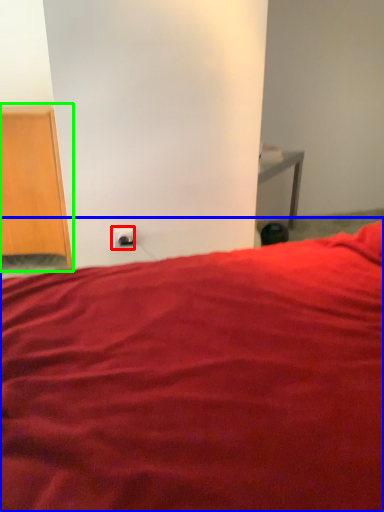
Question: Which is farther away from electric outlet (highlighted by a red box)? bed (highlighted by a blue box) or furniture (highlighted by a green box)?

Choices:
 (A) bed
 (B) furniture

Answer: (A)